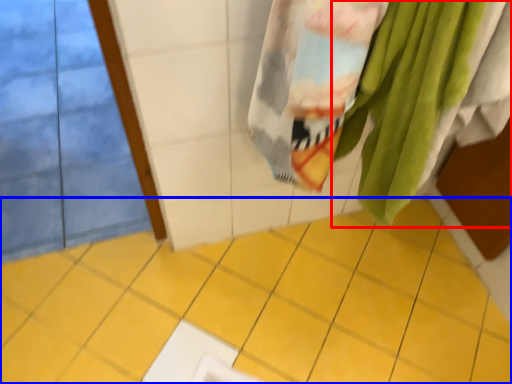
Question: Which of the following is the farthest to the observer, towel (highlighted by a red box) or ceramic tile (highlighted by a blue box)?

Choices:
 (A) towel
 (B) ceramic tile

Answer: (B)